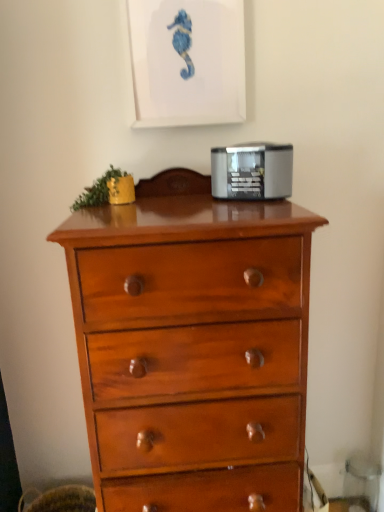
Question: Could matte white picture frame at upper center be considered to be inside shiny wood chest of drawers at center?

Choices:
 (A) no
 (B) yes

Answer: (A)

Question: Is shiny wood chest of drawers at center thinner than matte white picture frame at upper center?

Choices:
 (A) no
 (B) yes

Answer: (A)

Question: Is shiny wood chest of drawers at center looking in the opposite direction of matte white picture frame at upper center?

Choices:
 (A) no
 (B) yes

Answer: (A)

Question: Is shiny wood chest of drawers at center closer to camera compared to matte white picture frame at upper center?

Choices:
 (A) yes
 (B) no

Answer: (A)

Question: From the image's perspective, is shiny wood chest of drawers at center located beneath matte white picture frame at upper center?

Choices:
 (A) no
 (B) yes

Answer: (B)

Question: Is shiny wood chest of drawers at center positioned behind matte white picture frame at upper center?

Choices:
 (A) no
 (B) yes

Answer: (A)

Question: Is matte white picture frame at upper center oriented towards satin silver toaster at upper center?

Choices:
 (A) no
 (B) yes

Answer: (A)

Question: Can you confirm if matte white picture frame at upper center is positioned to the left of satin silver toaster at upper center?

Choices:
 (A) yes
 (B) no

Answer: (A)

Question: Considering the relative sizes of matte white picture frame at upper center and satin silver toaster at upper center in the image provided, is matte white picture frame at upper center wider than satin silver toaster at upper center?

Choices:
 (A) yes
 (B) no

Answer: (B)

Question: Considering the relative sizes of matte white picture frame at upper center and satin silver toaster at upper center in the image provided, is matte white picture frame at upper center smaller than satin silver toaster at upper center?

Choices:
 (A) no
 (B) yes

Answer: (A)

Question: Is matte white picture frame at upper center placed right next to satin silver toaster at upper center?

Choices:
 (A) no
 (B) yes

Answer: (A)

Question: Is satin silver toaster at upper center at the back of matte white picture frame at upper center?

Choices:
 (A) no
 (B) yes

Answer: (A)

Question: Is matte white picture frame at upper center outside of shiny wood chest of drawers at center?

Choices:
 (A) no
 (B) yes

Answer: (B)